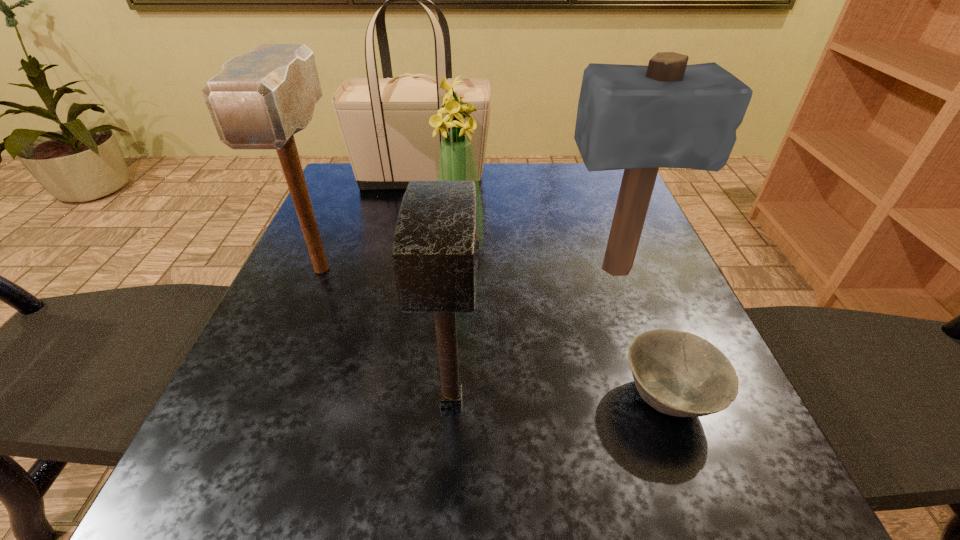
The width and height of the screenshot is (960, 540). I want to click on free point at the near edge, so click(x=492, y=461).

Where is `vacant space at the left edge`? vacant space at the left edge is located at coordinates (324, 438).

Where is `vacant space at the right edge`? The image size is (960, 540). vacant space at the right edge is located at coordinates (616, 357).

The image size is (960, 540). Identify the location of vacant area at the near left corner. (192, 514).

Where is `free space at the far right corner of the desktop`? The height and width of the screenshot is (540, 960). free space at the far right corner of the desktop is located at coordinates (586, 199).

In the image, there is a desktop. Find the location of `vacant space at the near right corner`. vacant space at the near right corner is located at coordinates (741, 499).

Where is `vacant point located between the rightmost mallet and the farthest object`? The width and height of the screenshot is (960, 540). vacant point located between the rightmost mallet and the farthest object is located at coordinates (518, 224).

Image resolution: width=960 pixels, height=540 pixels. What are the coordinates of `unoccupied position between the farthest object and the rightmost mallet` in the screenshot? It's located at (518, 224).

Find the location of a particular element. unoccupied position between the shortest mallet and the rightmost mallet is located at coordinates (533, 335).

Identify the location of free space between the leftmost mallet and the bouquet. This screenshot has height=540, width=960. (391, 259).